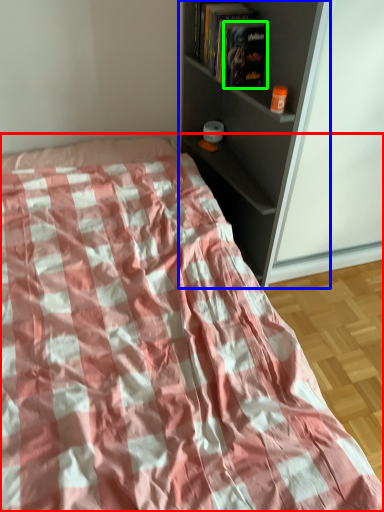
Question: Estimate the real-world distances between objects in this image. Which object is farther from bed (highlighted by a red box), shelf (highlighted by a blue box) or paperback book (highlighted by a green box)?

Choices:
 (A) shelf
 (B) paperback book

Answer: (B)